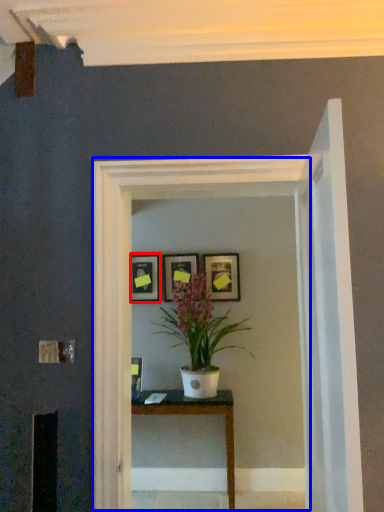
Question: Which object appears farthest to the camera in this image, picture frame (highlighted by a red box) or glass door (highlighted by a blue box)?

Choices:
 (A) picture frame
 (B) glass door

Answer: (A)